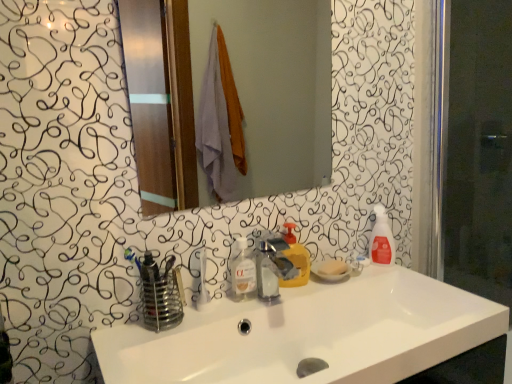
Find the location of `free region on the left part of metallic silver faucet at center`. free region on the left part of metallic silver faucet at center is located at coordinates (223, 308).